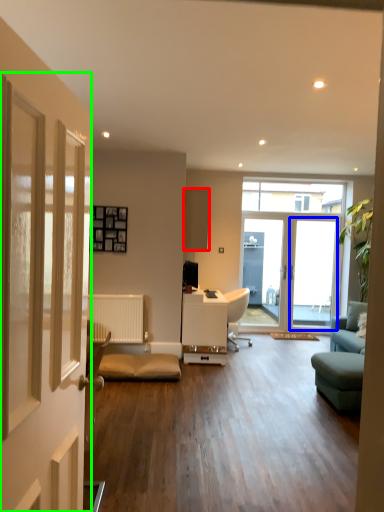
Question: Which is farther away from cabinetry (highlighted by a red box)? screen door (highlighted by a blue box) or door (highlighted by a green box)?

Choices:
 (A) screen door
 (B) door

Answer: (B)